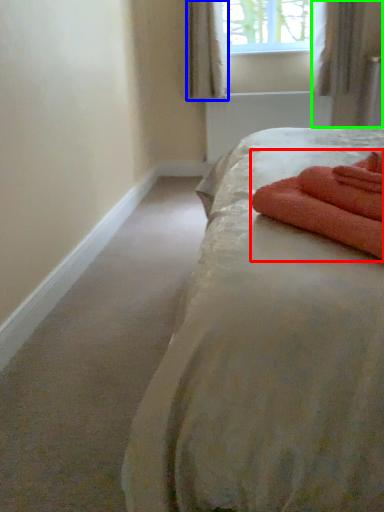
Question: Which is nearer to the bath towel (highlighted by a red box)? curtain (highlighted by a blue box) or curtain (highlighted by a green box).

Choices:
 (A) curtain
 (B) curtain

Answer: (B)